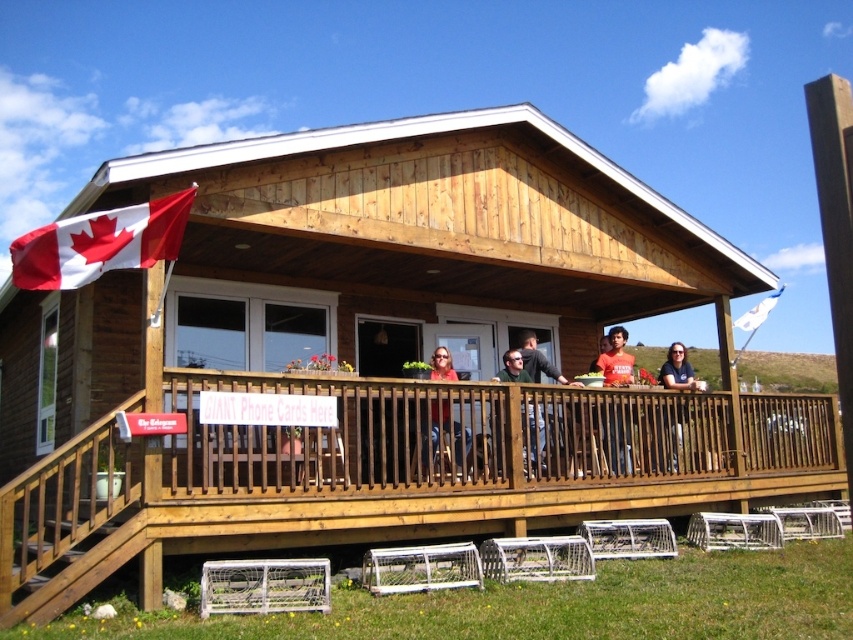
Question: Can you confirm if dark gray shirt at center is positioned to the right of white fabric flag at upper right?

Choices:
 (A) yes
 (B) no

Answer: (B)

Question: Based on their relative distances, which object is farther from the dark blue shirt at center?

Choices:
 (A) dark gray shirt at center
 (B) matte red shirt at center

Answer: (B)

Question: Based on their relative distances, which object is nearer to the red and white fabric flag at upper left?

Choices:
 (A) dark gray shirt at center
 (B) dark blue shirt at center
 (C) white fabric flag at upper right

Answer: (A)

Question: Which point is farther to the camera?

Choices:
 (A) matte orange t-shirt at center
 (B) red and white fabric flag at upper left

Answer: (A)

Question: Is brown wooden porch at upper center to the right of red and white fabric flag at upper left from the viewer's perspective?

Choices:
 (A) yes
 (B) no

Answer: (A)

Question: Can you confirm if matte red shirt at center is wider than dark gray shirt at center?

Choices:
 (A) yes
 (B) no

Answer: (B)